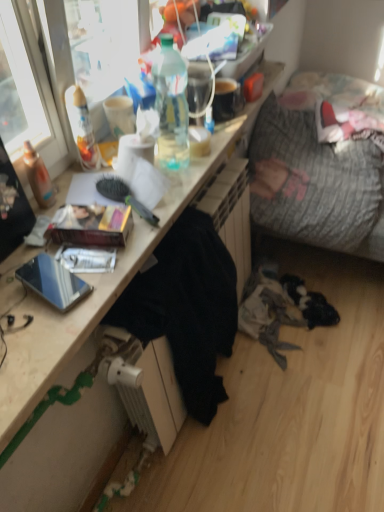
The image size is (384, 512). I want to click on free space that is to the left of shiny metallic phone at lower left, so click(17, 290).